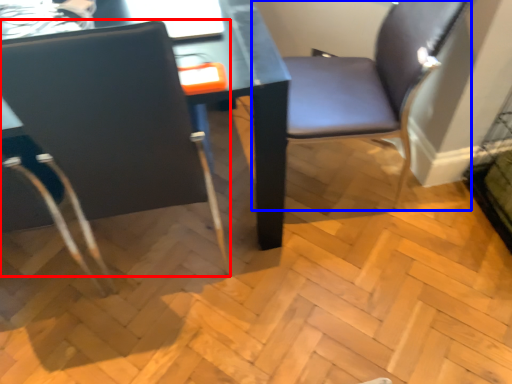
Question: Which of the following is the farthest to the observer, chair (highlighted by a red box) or chair (highlighted by a blue box)?

Choices:
 (A) chair
 (B) chair

Answer: (B)